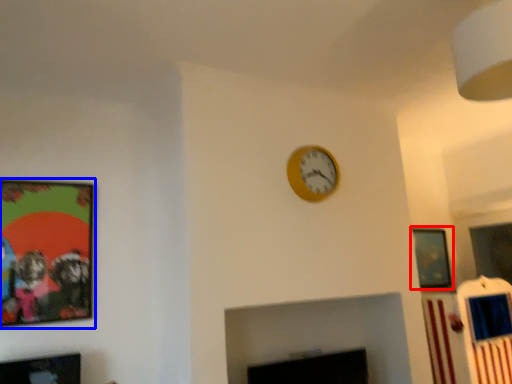
Question: Which object appears closest to the camera in this image, picture frame (highlighted by a red box) or picture frame (highlighted by a blue box)?

Choices:
 (A) picture frame
 (B) picture frame

Answer: (B)